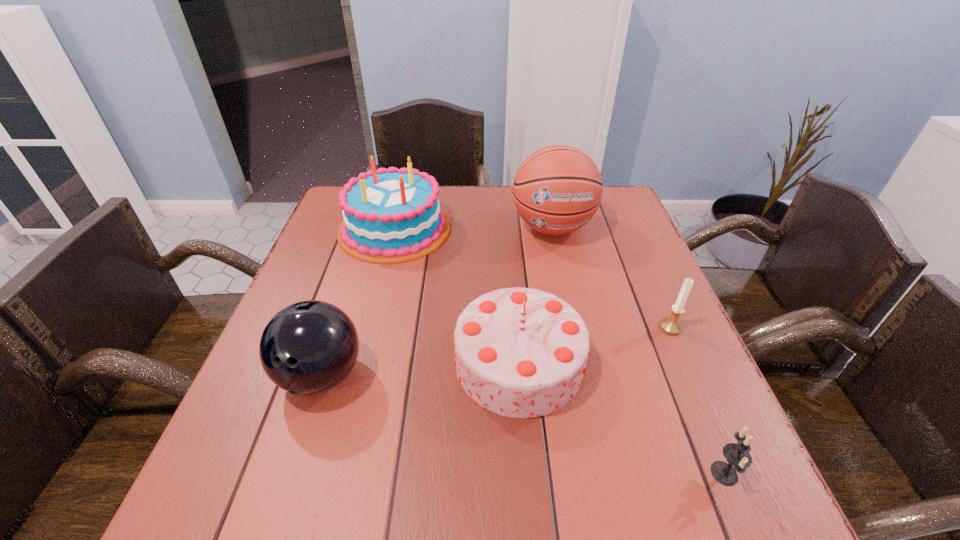
Where is `free space that satisfies the following two spatial constraints: 1. on the front side of the nearer birthday cake; 2. on the left side of the left birthday cake`? The image size is (960, 540). free space that satisfies the following two spatial constraints: 1. on the front side of the nearer birthday cake; 2. on the left side of the left birthday cake is located at coordinates (361, 362).

Find the location of a particular element. free location that satisfies the following two spatial constraints: 1. on the front side of the farther birthday cake; 2. on the right side of the nearer candle holder is located at coordinates (333, 474).

Identify the location of vacant space that satisfies the following two spatial constraints: 1. on the logo side of the basketball; 2. on the left side of the fifth tallest object. The image size is (960, 540). (574, 327).